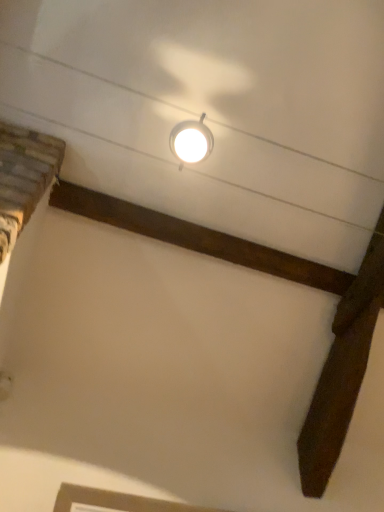
Where is `matte white lamp at upper center`? This screenshot has width=384, height=512. matte white lamp at upper center is located at coordinates (191, 141).

What do you see at coordinates (191, 141) in the screenshot? I see `matte white lamp at upper center` at bounding box center [191, 141].

Image resolution: width=384 pixels, height=512 pixels. Find the location of `matte white lamp at upper center`. matte white lamp at upper center is located at coordinates (191, 141).